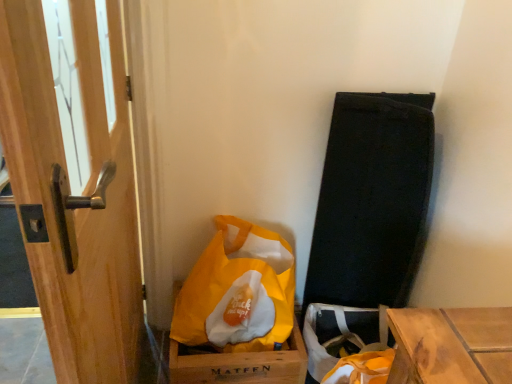
This screenshot has width=512, height=384. Describe the element at coordinates (239, 364) in the screenshot. I see `yellow matte cardboard box at lower center` at that location.

The image size is (512, 384). Describe the element at coordinates (238, 291) in the screenshot. I see `yellow fabric bag at lower center` at that location.

Locate an element on the screen. yellow matte cardboard box at lower center is located at coordinates (239, 364).

Looking at this image, which object is further away from the camera, wooden door handle at left or yellow matte cardboard box at lower center?

yellow matte cardboard box at lower center is further from the camera.

How many degrees apart are the facing directions of wooden door handle at left and yellow matte cardboard box at lower center?

90.7 degrees separate the facing orientations of wooden door handle at left and yellow matte cardboard box at lower center.

How much distance is there between wooden door handle at left and yellow matte cardboard box at lower center?

wooden door handle at left and yellow matte cardboard box at lower center are 19.91 inches apart.

Does wooden door handle at left appear on the left side of yellow matte cardboard box at lower center?

Yes.

Between yellow fabric bag at lower center and yellow matte cardboard box at lower center, which one has larger size?

Bigger between the two is yellow fabric bag at lower center.

In the image, is yellow fabric bag at lower center on the left side or the right side of yellow matte cardboard box at lower center?

From the image, it's evident that yellow fabric bag at lower center is to the right of yellow matte cardboard box at lower center.

Is yellow fabric bag at lower center further to camera compared to yellow matte cardboard box at lower center?

That is False.

Consider the image. Between yellow fabric bag at lower center and yellow matte cardboard box at lower center, which one has less height?

yellow matte cardboard box at lower center.

Is yellow matte cardboard box at lower center spatially inside wooden door handle at left, or outside of it?

yellow matte cardboard box at lower center is located beyond the bounds of wooden door handle at left.

Is yellow matte cardboard box at lower center taller or shorter than wooden door handle at left?

yellow matte cardboard box at lower center is shorter than wooden door handle at left.

From the image's perspective, would you say yellow matte cardboard box at lower center is shown under wooden door handle at left?

Correct, yellow matte cardboard box at lower center appears lower than wooden door handle at left in the image.

Between point (41, 74) and point (289, 289), which one is positioned in front?

Positioned in front is point (41, 74).

From a real-world perspective, is wooden door handle at left located higher than yellow fabric bag at lower center?

Indeed, from a real-world perspective, wooden door handle at left stands above yellow fabric bag at lower center.

Can you tell me how much wooden door handle at left and yellow fabric bag at lower center differ in facing direction?

The facing directions of wooden door handle at left and yellow fabric bag at lower center are 89.8 degrees apart.

Identify the location of plastic bag below the wooden door handle at left (from a real-world perspective). Image resolution: width=512 pixels, height=384 pixels. (238, 291).

Does point (201, 352) lie behind point (280, 271)?

Yes, point (201, 352) is behind point (280, 271).

Is yellow matte cardboard box at lower center to the right of yellow fabric bag at lower center from the viewer's perspective?

No.

From the image's perspective, relative to yellow fabric bag at lower center, is yellow matte cardboard box at lower center above or below?

Based on their image positions, yellow matte cardboard box at lower center is located beneath yellow fabric bag at lower center.

How different are the orientations of yellow fabric bag at lower center and wooden door handle at left in degrees?

The angular difference between yellow fabric bag at lower center and wooden door handle at left is 89.8 degrees.

Which of these two, yellow fabric bag at lower center or wooden door handle at left, is smaller?

With smaller size is yellow fabric bag at lower center.

From the image's perspective, which object appears higher, yellow fabric bag at lower center or wooden door handle at left?

wooden door handle at left.

Is yellow fabric bag at lower center touching wooden door handle at left?

No, yellow fabric bag at lower center is not touching wooden door handle at left.

This screenshot has width=512, height=384. In order to click on cardboard box on the right of wooden door handle at left in this screenshot , I will do (239, 364).

Find the location of `cardboard box below the yellow fabric bag at lower center (from the image's perspective)`. cardboard box below the yellow fabric bag at lower center (from the image's perspective) is located at coordinates (239, 364).

Based on their spatial positions, is wooden door handle at left or yellow fabric bag at lower center closer to yellow matte cardboard box at lower center?

yellow fabric bag at lower center lies closer to yellow matte cardboard box at lower center than the other object.

When comparing their distances from yellow fabric bag at lower center, does wooden door handle at left or yellow matte cardboard box at lower center seem further?

The object further to yellow fabric bag at lower center is wooden door handle at left.

Which object lies nearer to the anchor point wooden door handle at left, yellow matte cardboard box at lower center or yellow fabric bag at lower center?

yellow fabric bag at lower center is closer to wooden door handle at left.

Estimate the real-world distances between objects in this image. Which object is closer to yellow matte cardboard box at lower center, yellow fabric bag at lower center or wooden door handle at left?

yellow fabric bag at lower center is closer to yellow matte cardboard box at lower center.

Looking at this image, based on their spatial positions, is yellow fabric bag at lower center or yellow matte cardboard box at lower center closer to wooden door handle at left?

yellow fabric bag at lower center lies closer to wooden door handle at left than the other object.

Based on their spatial positions, is yellow matte cardboard box at lower center or wooden door handle at left closer to yellow fabric bag at lower center?

yellow matte cardboard box at lower center is closer to yellow fabric bag at lower center.

Identify the location of plastic bag between wooden door handle at left and yellow matte cardboard box at lower center from front to back. This screenshot has height=384, width=512. (238, 291).